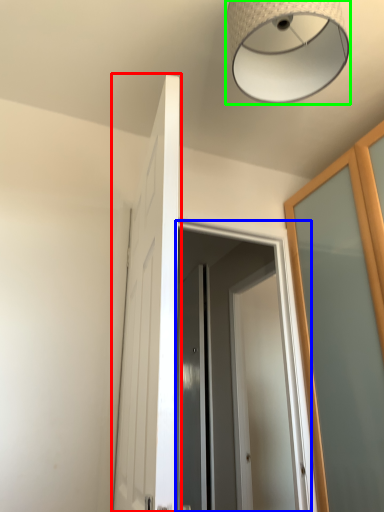
Question: Which is farther away from door (highlighted by a red box)? screen door (highlighted by a blue box) or lamp (highlighted by a green box)?

Choices:
 (A) screen door
 (B) lamp

Answer: (A)